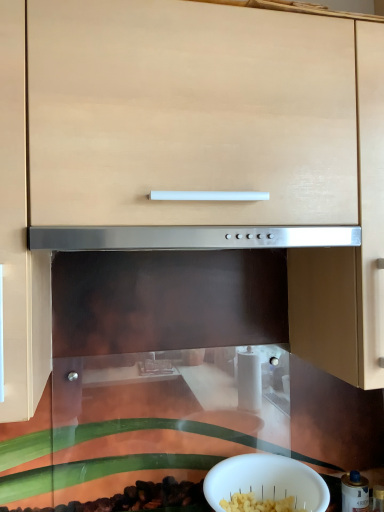
Question: Is white matte bowl at lower center taller or shorter than metallic silver canister at lower right?

Choices:
 (A) tall
 (B) short

Answer: (B)

Question: Visually, is white matte bowl at lower center positioned to the left or to the right of metallic silver canister at lower right?

Choices:
 (A) right
 (B) left

Answer: (B)

Question: Considering the positions of point (231, 468) and point (367, 509), is point (231, 468) closer or farther from the camera than point (367, 509)?

Choices:
 (A) closer
 (B) farther

Answer: (A)

Question: In terms of width, does metallic silver canister at lower right look wider or thinner when compared to white matte bowl at lower center?

Choices:
 (A) wide
 (B) thin

Answer: (B)

Question: Visually, is metallic silver canister at lower right positioned to the left or to the right of white matte bowl at lower center?

Choices:
 (A) left
 (B) right

Answer: (B)

Question: From the image's perspective, relative to white matte bowl at lower center, is metallic silver canister at lower right above or below?

Choices:
 (A) below
 (B) above

Answer: (A)

Question: Considering the positions of metallic silver canister at lower right and white matte bowl at lower center in the image, is metallic silver canister at lower right taller or shorter than white matte bowl at lower center?

Choices:
 (A) tall
 (B) short

Answer: (A)